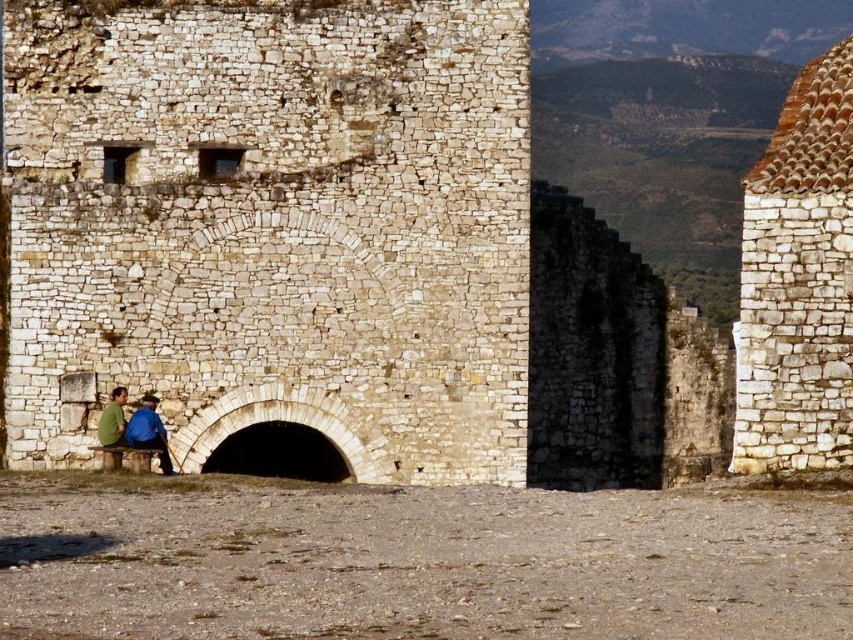
You are an architect examining the historic stone structure. You notice the white stone roof at upper right and the green matte shirt at lower left. Which object has a greater width when comparing their sizes?

The white stone roof at upper right has a greater width than the green matte shirt at lower left.

From the picture: You are standing in front of the historic stone structure and notice two shirts at the lower left corner of the image. Which shirt is closer to you, the blue shirt at lower left or the green matte shirt at lower left?

The blue shirt at lower left is closer to you because the green matte shirt at lower left is behind it.